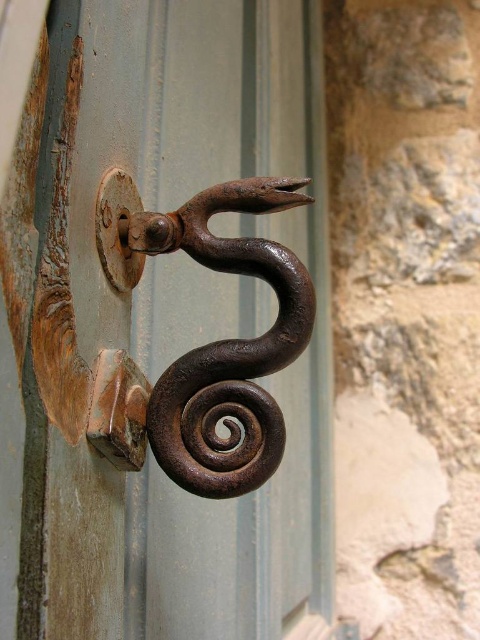
Question: Which point appears closest to the camera in this image?

Choices:
 (A) (166, 236)
 (B) (81, 198)

Answer: (B)

Question: Which point is closer to the camera?

Choices:
 (A) pos(131,49)
 (B) pos(236,451)

Answer: (B)

Question: Which object is closer to the camera taking this photo?

Choices:
 (A) rusty iron hook at center
 (B) rusty metal hook at center

Answer: (B)

Question: Does rusty metal hook at center have a greater width compared to rusty iron hook at center?

Choices:
 (A) yes
 (B) no

Answer: (A)

Question: Does rusty metal hook at center have a larger size compared to rusty iron hook at center?

Choices:
 (A) no
 (B) yes

Answer: (B)

Question: Observing the image, what is the correct spatial positioning of rusty metal hook at center in reference to rusty iron hook at center?

Choices:
 (A) above
 (B) below

Answer: (B)